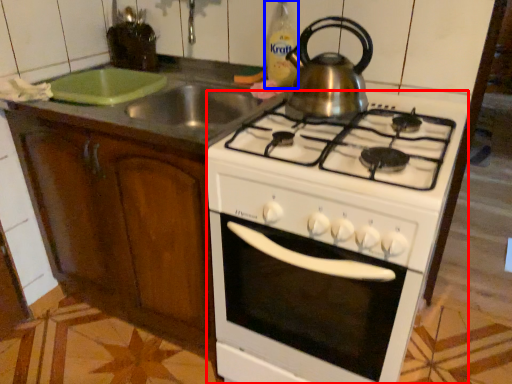
Question: Which point is closer to the camera, oven (highlighted by a red box) or bottle (highlighted by a blue box)?

Choices:
 (A) oven
 (B) bottle

Answer: (A)